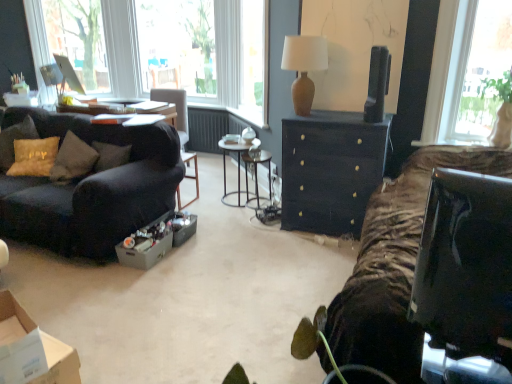
Question: Considering their positions, is gold textured pillow at left located in front of or behind matte gray cardboard box at center?

Choices:
 (A) behind
 (B) front

Answer: (A)

Question: Is gold textured pillow at left taller or shorter than matte gray cardboard box at center?

Choices:
 (A) tall
 (B) short

Answer: (A)

Question: Which object is positioned closest to the matte brown vase at upper center?

Choices:
 (A) matte black dresser at center
 (B) zebra-patterned fabric at right
 (C) black glossy television at upper right
 (D) gold textured pillow at left
 (E) velvet dark brown couch at left

Answer: (C)

Question: Which object is positioned farthest from the matte black dresser at center?

Choices:
 (A) zebra-patterned fabric at right
 (B) metallic silver side table at center
 (C) gold textured pillow at left
 (D) transparent glass window at upper center, placed as the 1th window screen when sorted from right to left
 (E) matte glass screen at upper left, acting as the first window screen starting from the left

Answer: (E)